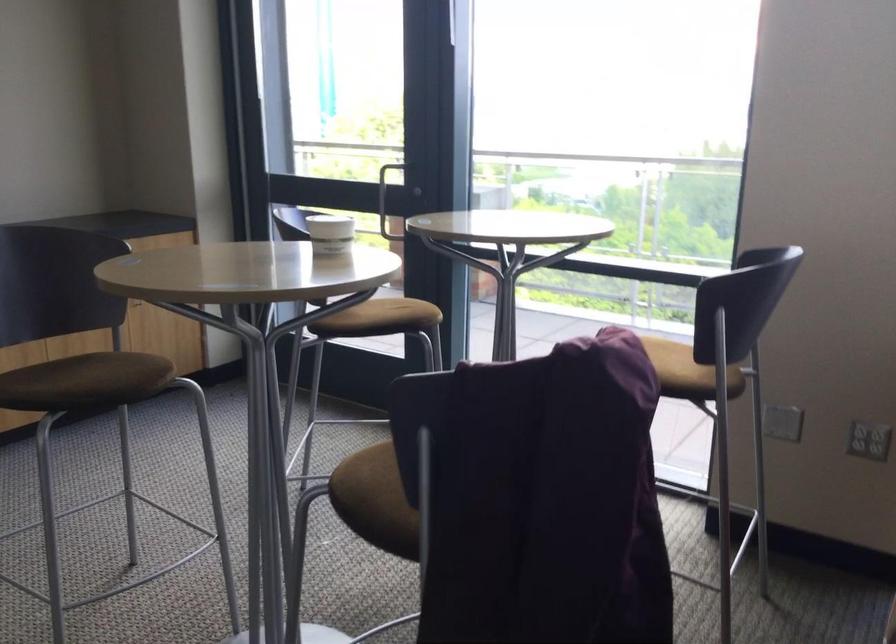
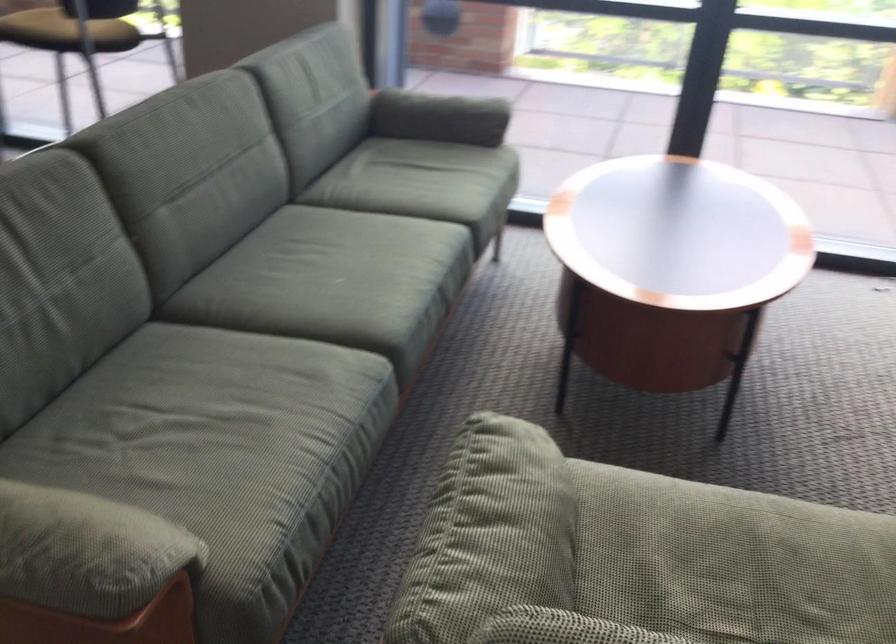
In the scene shown: The images are taken continuously from a first-person perspective. In which direction are you moving?

The cameraman walked toward right, backward.